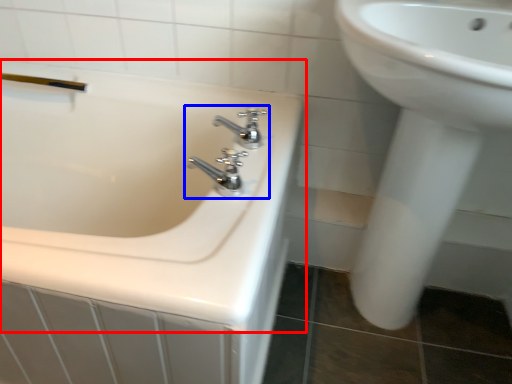
Question: Which object appears closest to the camera in this image, bathtub (highlighted by a red box) or tap (highlighted by a blue box)?

Choices:
 (A) bathtub
 (B) tap

Answer: (A)